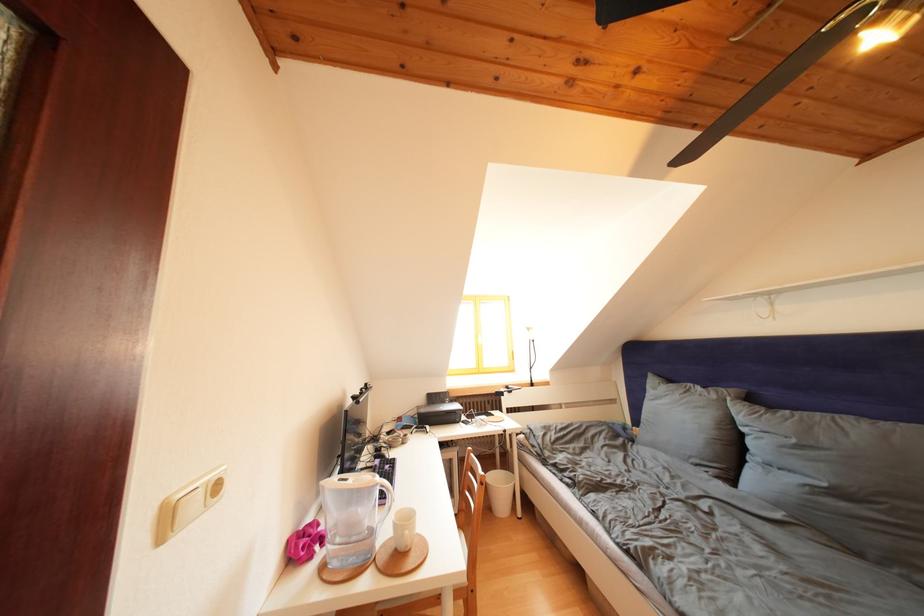
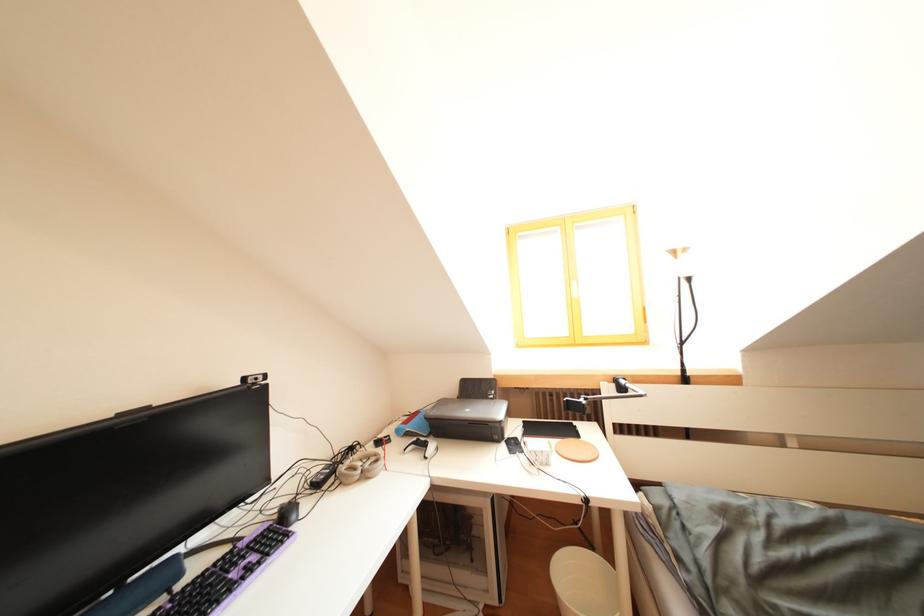
Question: In a continuous first-person perspective shot, in which direction is the camera moving?

Choices:
 (A) Left
 (B) Right
 (C) Forward
 (D) Backward

Answer: (C)